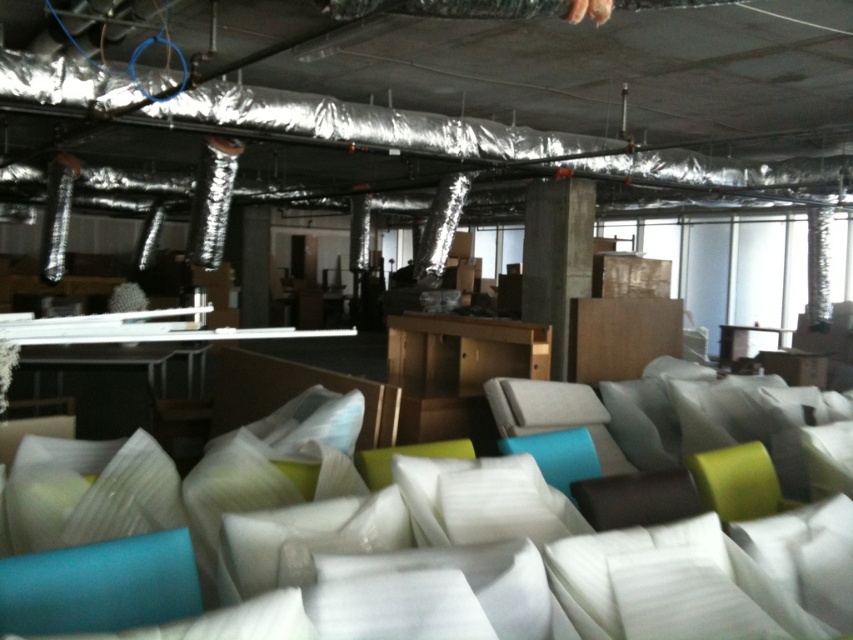
Question: Does white fabric couch at center appear on the right side of wooden cabinet at center?

Choices:
 (A) no
 (B) yes

Answer: (A)

Question: Which point appears closest to the camera in this image?

Choices:
 (A) (329, 536)
 (B) (550, 352)

Answer: (A)

Question: Which object is farther from the camera taking this photo?

Choices:
 (A) wooden cabinet at center
 (B) concrete at center

Answer: (B)

Question: Is white fabric couch at center bigger than concrete at center?

Choices:
 (A) no
 (B) yes

Answer: (B)

Question: Which point is farther to the camera?

Choices:
 (A) (751, 577)
 (B) (426, 404)

Answer: (B)

Question: From the image, what is the correct spatial relationship of white fabric couch at center in relation to concrete at center?

Choices:
 (A) left
 (B) right

Answer: (A)